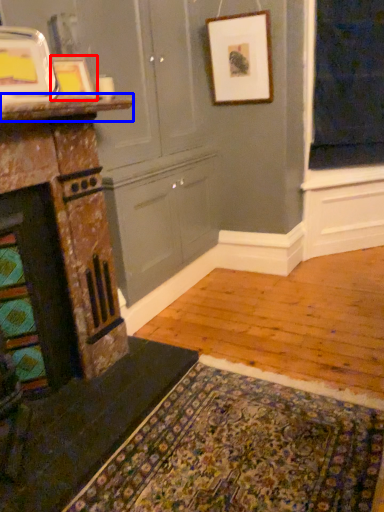
Question: Which point is closer to the camera, picture frame (highlighted by a red box) or counter top (highlighted by a blue box)?

Choices:
 (A) picture frame
 (B) counter top

Answer: (B)